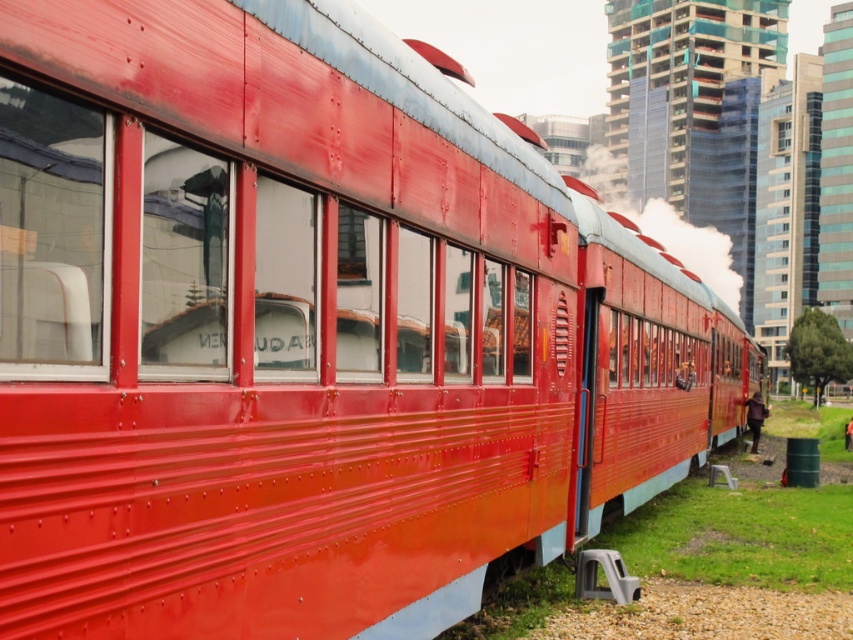
Question: In this image, where is clear glass window at center located relative to orange fabric jacket at lower right?

Choices:
 (A) below
 (B) above

Answer: (B)

Question: Which point is farther to the camera?

Choices:
 (A) (171, 288)
 (B) (849, 429)

Answer: (B)

Question: Is cracked glass window at center wider than orange fabric jacket at lower right?

Choices:
 (A) yes
 (B) no

Answer: (B)

Question: Among these objects, which one is farthest from the camera?

Choices:
 (A) clear glass window at center
 (B) cracked glass window at center
 (C) orange fabric jacket at lower right
 (D) dark brown leather jacket at lower right

Answer: (C)

Question: Does clear glass window at center have a smaller size compared to orange fabric jacket at lower right?

Choices:
 (A) no
 (B) yes

Answer: (B)

Question: Which object is the farthest from the clear glass window at center?

Choices:
 (A) cracked glass window at center
 (B) orange fabric jacket at lower right
 (C) dark brown leather jacket at lower right

Answer: (B)